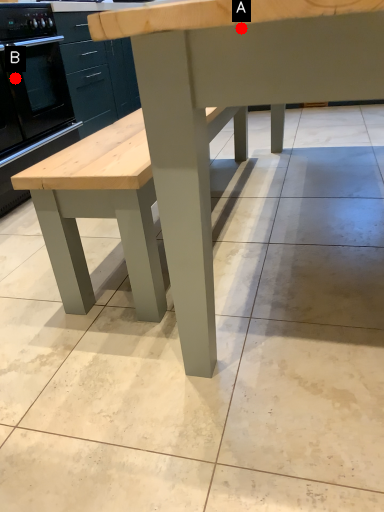
Question: Two points are circled on the image, labeled by A and B beside each circle. Which point appears closest to the camera in this image?

Choices:
 (A) A is closer
 (B) B is closer

Answer: (A)